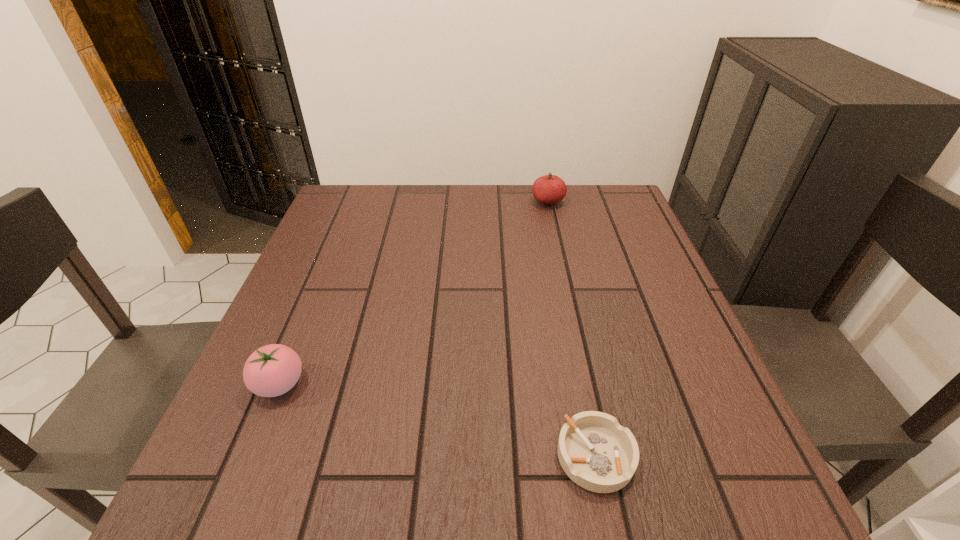
At what (x,y) coordinates should I click in order to perform the action: click on object that is the closest to the ashtray. Please return your answer as a coordinate pair (x, y). This screenshot has height=540, width=960. Looking at the image, I should click on (272, 370).

This screenshot has height=540, width=960. I want to click on free spot that satisfies the following two spatial constraints: 1. on the back side of the farthest object; 2. on the left side of the nearest object, so click(543, 201).

The image size is (960, 540). Find the location of `free point that satisfies the following two spatial constraints: 1. on the front side of the second nearest object; 2. on the right side of the ashtray`. free point that satisfies the following two spatial constraints: 1. on the front side of the second nearest object; 2. on the right side of the ashtray is located at coordinates (250, 456).

Find the location of a particular element. The width and height of the screenshot is (960, 540). vacant space that satisfies the following two spatial constraints: 1. on the back side of the second farthest object; 2. on the left side of the right tomato is located at coordinates (354, 201).